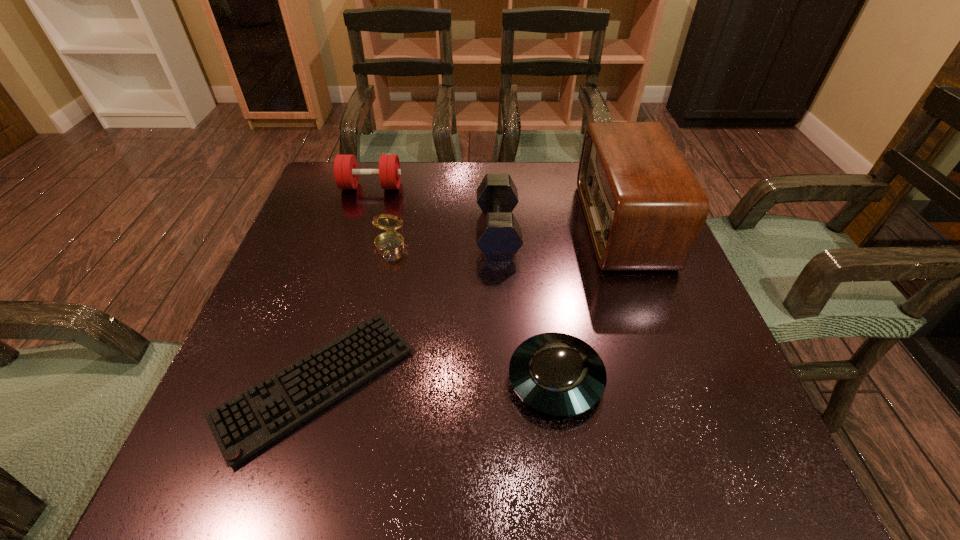
Where is `free space between the saucer and the compass`? This screenshot has width=960, height=540. free space between the saucer and the compass is located at coordinates (472, 313).

The image size is (960, 540). Identify the location of free area in between the computer keyboard and the rightmost object. (469, 304).

Locate an element on the screen. empty location between the computer keyboard and the left dumbbell is located at coordinates pyautogui.click(x=344, y=285).

I want to click on empty space between the farther dumbbell and the saucer, so click(x=464, y=283).

Identify which object is the fourth closest to the computer keyboard. Please provide its 2D coordinates. Your answer should be formatted as a tuple, i.e. [(x, y)], where the tuple contains the x and y coordinates of a point satisfying the conditions above.

[(644, 208)]

Select which object appears as the second closest to the radio receiver. Please provide its 2D coordinates. Your answer should be formatted as a tuple, i.e. [(x, y)], where the tuple contains the x and y coordinates of a point satisfying the conditions above.

[(557, 374)]

This screenshot has height=540, width=960. What are the coordinates of `vacant space that satisfies the following two spatial constraints: 1. on the front side of the fifth tallest object; 2. on the right side of the left dumbbell` in the screenshot? It's located at (312, 379).

Locate an element on the screen. The image size is (960, 540). free spot that satisfies the following two spatial constraints: 1. on the back side of the fifth tallest object; 2. on the right side of the shortest object is located at coordinates (318, 379).

In order to click on vacant point that satisfies the following two spatial constraints: 1. on the front side of the right dumbbell; 2. on the left side of the saucer in this screenshot , I will do `click(504, 379)`.

Find the location of a particular element. This screenshot has height=540, width=960. free spot that satisfies the following two spatial constraints: 1. on the front panel of the rightmost object; 2. on the front side of the nearer dumbbell is located at coordinates (625, 231).